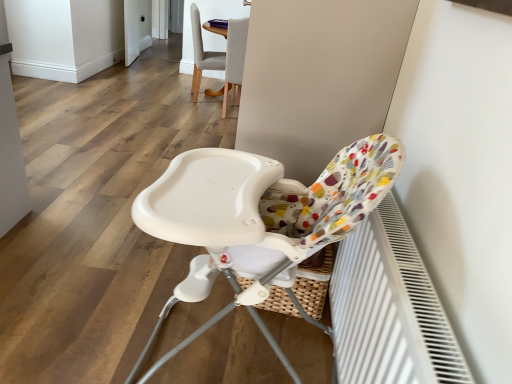
Find the location of a particular element. The height and width of the screenshot is (384, 512). free point below matte gray chair at upper center, the 2th chair in the front-to-back sequence (from a real-world perspective) is located at coordinates (228, 108).